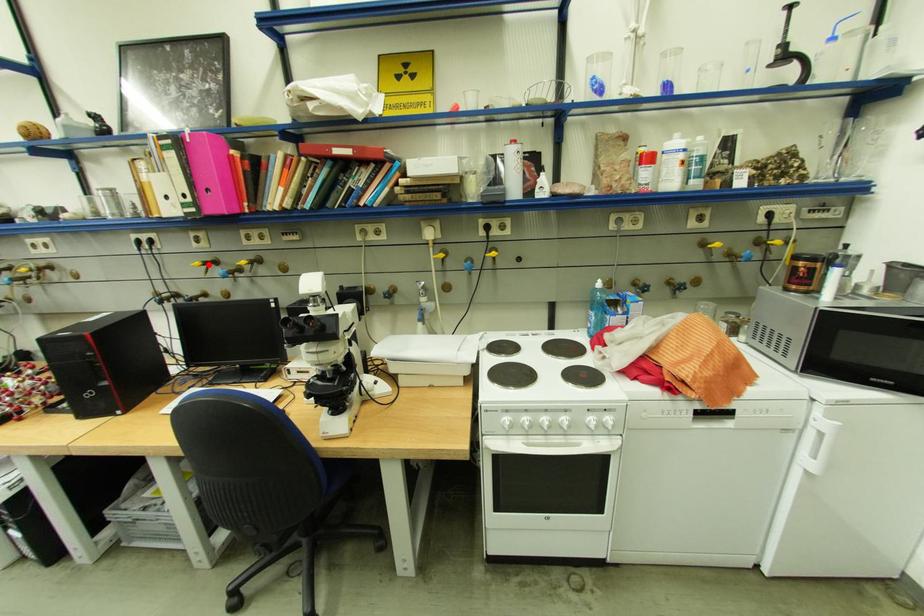
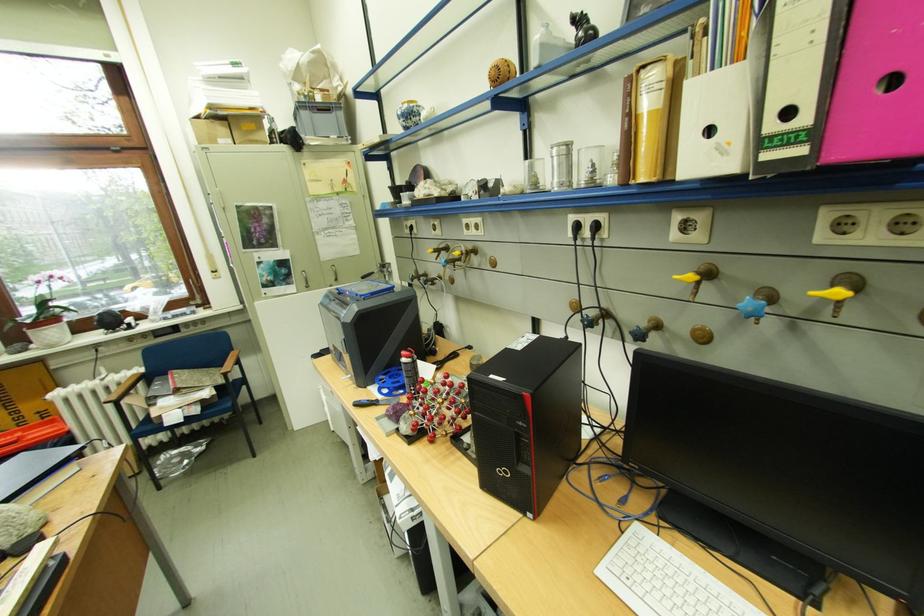
Find the pixel in the second image that matches the highlighted location in the first image.

(700, 277)